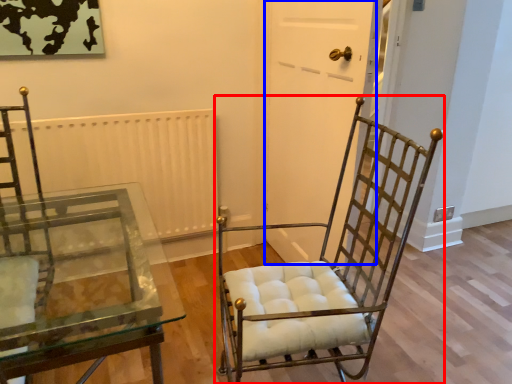
Question: Which object appears closest to the camera in this image, chair (highlighted by a red box) or glass door (highlighted by a blue box)?

Choices:
 (A) chair
 (B) glass door

Answer: (A)